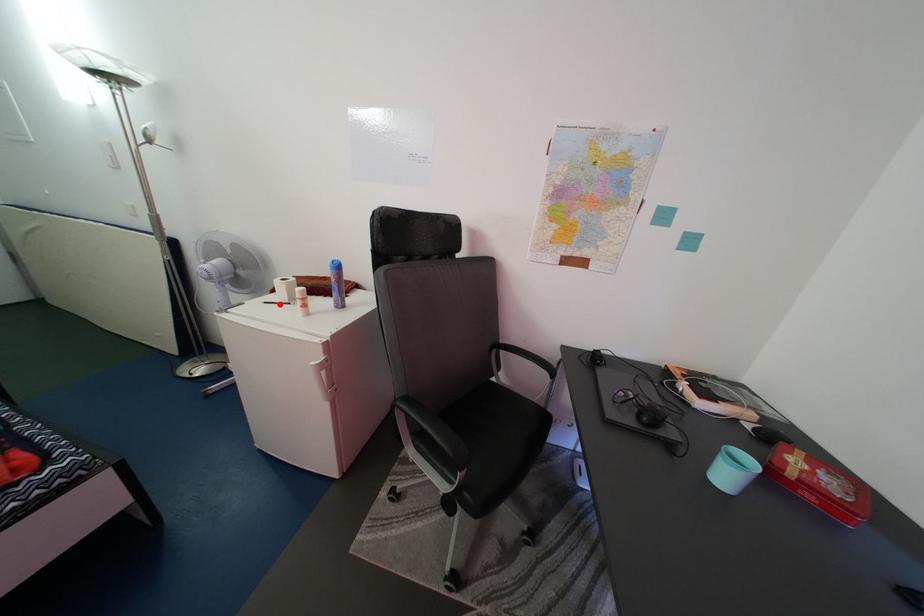
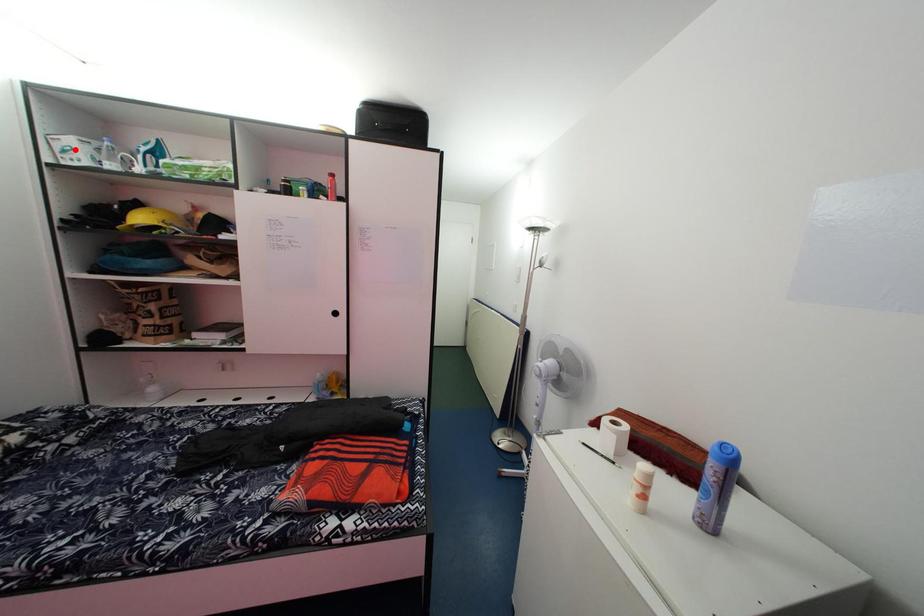
I am providing you with two images of the same scene from different viewpoints. A red point is marked on the first image and another point is marked on the second image. Is the marked point in image1 the same physical position as the marked point in image2?

No